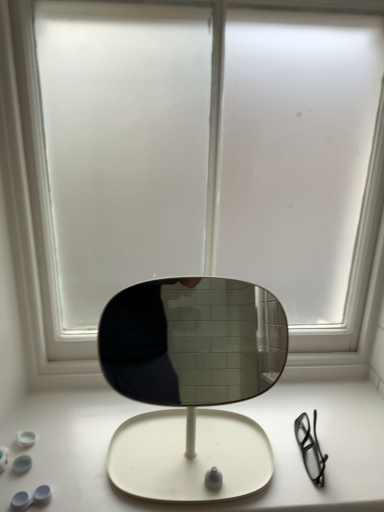
Question: Is white matte table at center bigger or smaller than frosted glass window at center?

Choices:
 (A) big
 (B) small

Answer: (B)

Question: Is white matte table at center to the left or to the right of frosted glass window at center in the image?

Choices:
 (A) right
 (B) left

Answer: (B)

Question: From the image's perspective, is white matte table at center located above or below frosted glass window at center?

Choices:
 (A) above
 (B) below

Answer: (B)

Question: Is frosted glass window at center in front of or behind white matte table at center in the image?

Choices:
 (A) front
 (B) behind

Answer: (A)

Question: Is frosted glass window at center wider or thinner than white matte table at center?

Choices:
 (A) wide
 (B) thin

Answer: (B)

Question: Based on their sizes in the image, would you say frosted glass window at center is bigger or smaller than white matte table at center?

Choices:
 (A) small
 (B) big

Answer: (B)

Question: Would you say frosted glass window at center is inside or outside white matte table at center?

Choices:
 (A) inside
 (B) outside

Answer: (B)